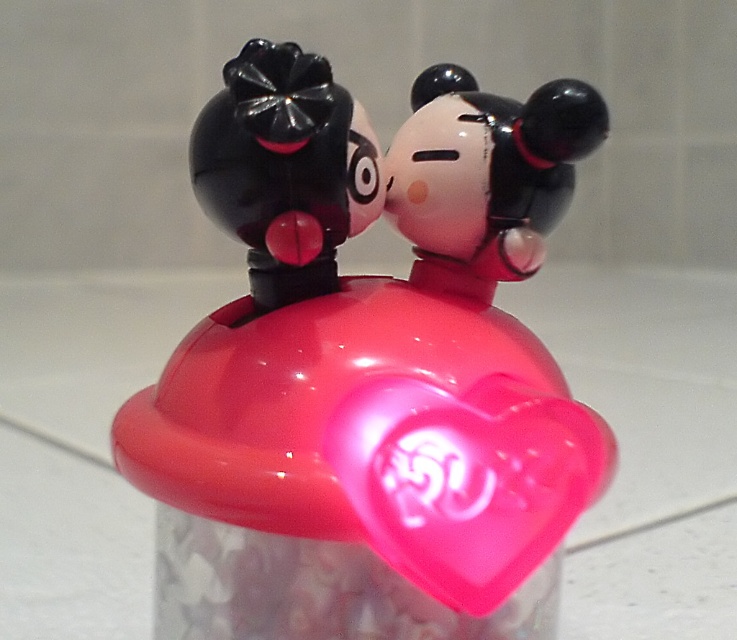
Question: Can you confirm if glossy plastic toy at center is positioned above glossy plastic figurine at center?

Choices:
 (A) no
 (B) yes

Answer: (A)

Question: Which point is closer to the camera?

Choices:
 (A) glossy plastic figurine at upper left
 (B) glossy plastic figurine at center
 (C) glossy plastic toy at center

Answer: (A)

Question: Can you confirm if glossy plastic heart at center is positioned below glossy plastic figurine at upper left?

Choices:
 (A) yes
 (B) no

Answer: (A)

Question: Which of these objects is positioned closest to the glossy plastic figurine at center?

Choices:
 (A) glossy plastic figurine at upper left
 (B) glossy plastic toy at center

Answer: (B)

Question: Can you confirm if glossy plastic toy at center is positioned above glossy plastic figurine at upper left?

Choices:
 (A) yes
 (B) no

Answer: (B)

Question: Based on their relative distances, which object is farther from the glossy plastic heart at center?

Choices:
 (A) glossy plastic figurine at center
 (B) glossy plastic toy at center
 (C) glossy plastic figurine at upper left

Answer: (A)